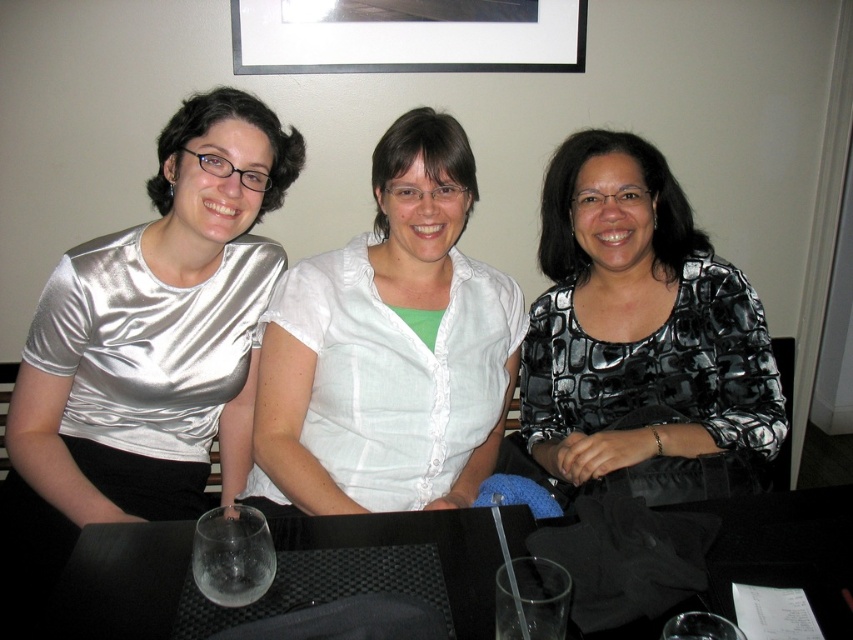
Question: Can you confirm if shiny silver blouse at left is positioned to the left of black matte picture frame at upper center?

Choices:
 (A) yes
 (B) no

Answer: (A)

Question: Which of the following is the closest to the observer?

Choices:
 (A) black matte table at center
 (B) black matte picture frame at upper center
 (C) transparent plastic wine glass at lower center
 (D) white linen shirt at center

Answer: (C)

Question: Which point is farther from the camera taking this photo?

Choices:
 (A) (138, 557)
 (B) (285, 12)
 (C) (521, 611)
 (D) (248, 573)

Answer: (B)

Question: Which point is closer to the camera?

Choices:
 (A) (686, 616)
 (B) (393, 8)
 (C) (138, 577)
 (D) (561, 198)

Answer: (A)

Question: Is shiny silver blouse at left positioned at the back of black printed blouse at right?

Choices:
 (A) no
 (B) yes

Answer: (A)

Question: Observing the image, what is the correct spatial positioning of shiny silver blouse at left in reference to black matte table at center?

Choices:
 (A) above
 (B) below

Answer: (A)